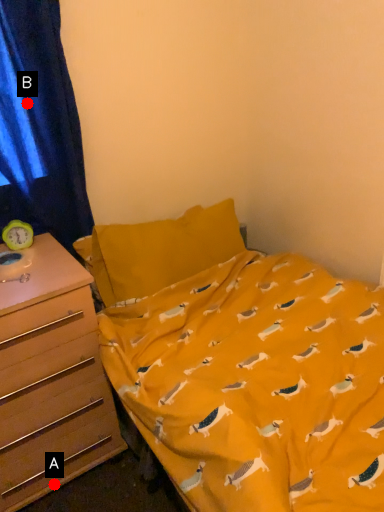
Question: Two points are circled on the image, labeled by A and B beside each circle. Among these points, which one is nearest to the camera?

Choices:
 (A) A is closer
 (B) B is closer

Answer: (B)